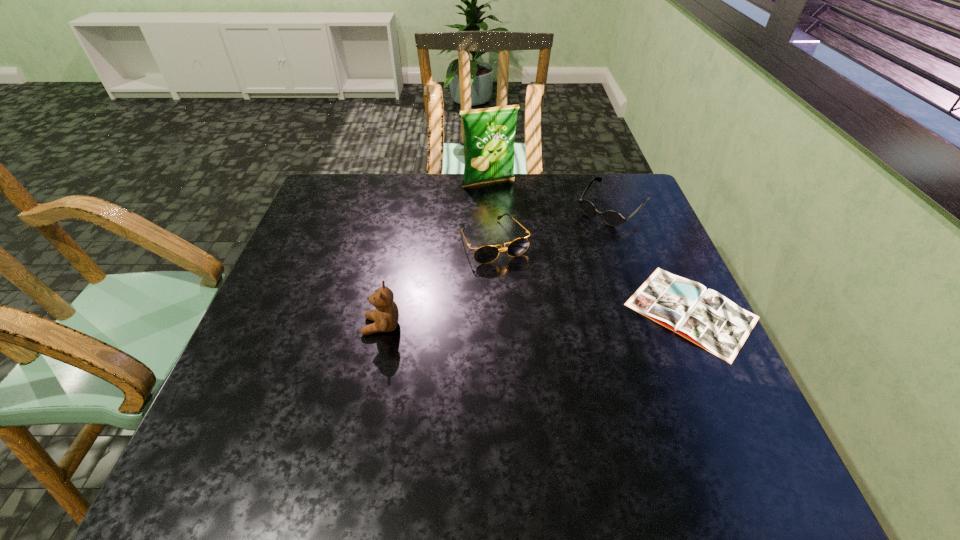
Identify the location of the leftmost object. (385, 316).

Locate an element on the screen. Image resolution: width=960 pixels, height=540 pixels. teddy bear is located at coordinates (385, 316).

The width and height of the screenshot is (960, 540). I want to click on the shortest object, so click(x=705, y=317).

The height and width of the screenshot is (540, 960). Identify the location of the right sunglasses. (612, 218).

What are the coordinates of `the tallest object` in the screenshot? It's located at (489, 133).

Find the location of `the left sunglasses`. the left sunglasses is located at coordinates (485, 254).

Where is `free point located 0.140m on the face of the teddy bear`? free point located 0.140m on the face of the teddy bear is located at coordinates (302, 326).

Identify the location of free location located 0.130m on the face of the teddy bear. Image resolution: width=960 pixels, height=540 pixels. (306, 326).

The height and width of the screenshot is (540, 960). In order to click on vacant space situated on the face of the teddy bear in this screenshot , I will do `click(333, 326)`.

Locate an element on the screen. blank space located 0.240m on the left of the shortest object is located at coordinates (524, 311).